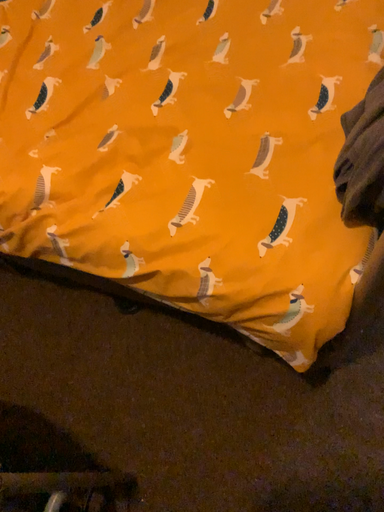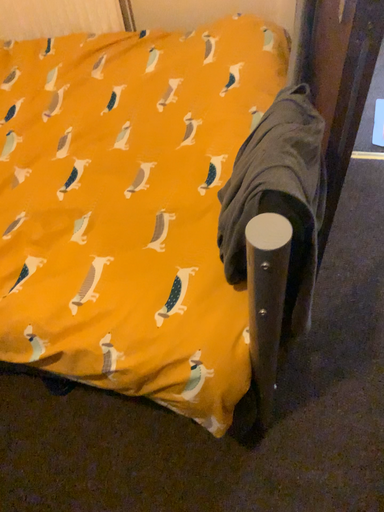
Question: How did the camera likely rotate when shooting the video?

Choices:
 (A) rotated upward
 (B) rotated downward

Answer: (A)